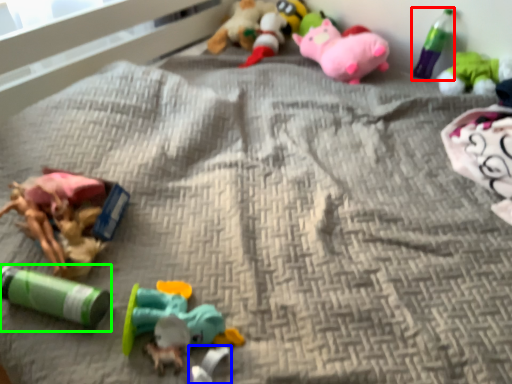
Question: Which object is positioned farthest from bottle (highlighted by a red box)? Select from toy (highlighted by a blue box) and toy (highlighted by a green box).

Choices:
 (A) toy
 (B) toy

Answer: (B)